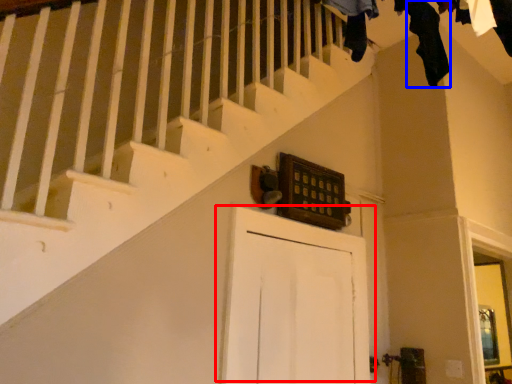
Question: Among these objects, which one is nearest to the camera, door (highlighted by a red box) or clothing (highlighted by a blue box)?

Choices:
 (A) door
 (B) clothing

Answer: (A)